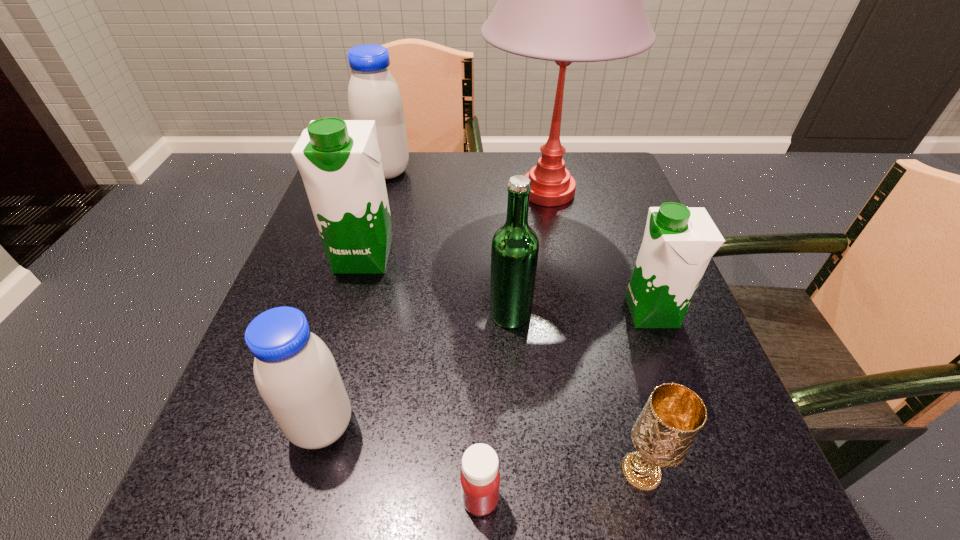
This screenshot has height=540, width=960. In order to click on vacant space located 0.130m on the front-facing side of the smaller green soya milk in this screenshot , I will do `click(552, 312)`.

You are a GUI agent. You are given a task and a screenshot of the screen. Output one action in this format:
    pyautogui.click(x=<x>, y=<y>)
    Task: Click on the blank space located on the back of the nearest soya milk
    The height and width of the screenshot is (540, 960).
    Given the screenshot: What is the action you would take?
    pyautogui.click(x=373, y=240)

The height and width of the screenshot is (540, 960). Identify the location of vacant area situated on the left of the chalice. (536, 472).

Find the location of `blank space located on the left of the shortest object`. blank space located on the left of the shortest object is located at coordinates (184, 498).

Image resolution: width=960 pixels, height=540 pixels. Find the location of `table lamp at the far edge`. table lamp at the far edge is located at coordinates click(566, 0).

Find the location of a particular element. soya milk located in the far edge section of the desktop is located at coordinates (373, 94).

The image size is (960, 540). In order to click on chalice that is at the near edge in this screenshot , I will do `click(673, 416)`.

Find the location of a particular element. The image size is (960, 540). medicine that is at the near edge is located at coordinates [x=480, y=478].

The width and height of the screenshot is (960, 540). Find the location of `table lamp that is at the right edge`. table lamp that is at the right edge is located at coordinates pyautogui.click(x=566, y=0).

In order to click on soya milk at the right edge in this screenshot , I will do `click(678, 243)`.